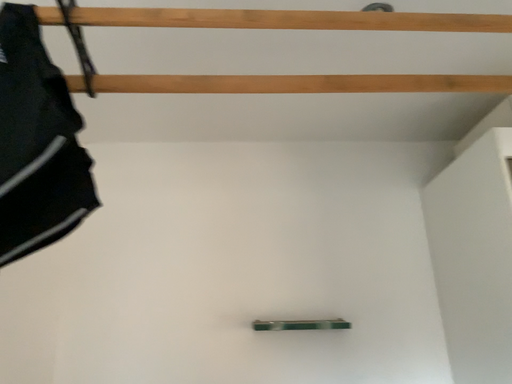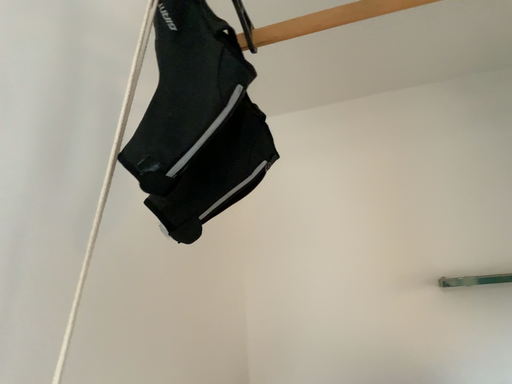
Question: Which way did the camera rotate in the video?

Choices:
 (A) rotated right
 (B) rotated left

Answer: (B)